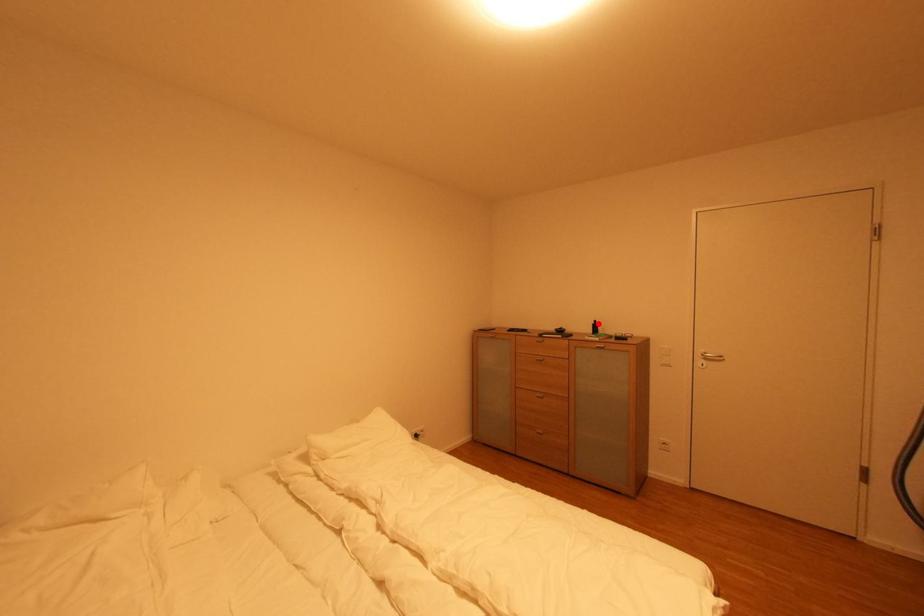
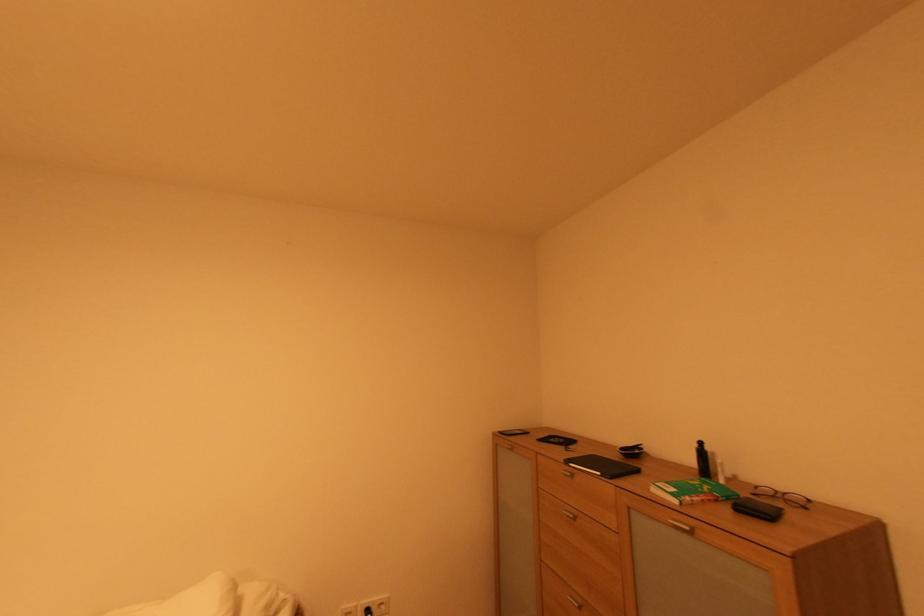
The point at the highlighted location is marked in the first image. Where is the corresponding point in the second image?

(701, 447)